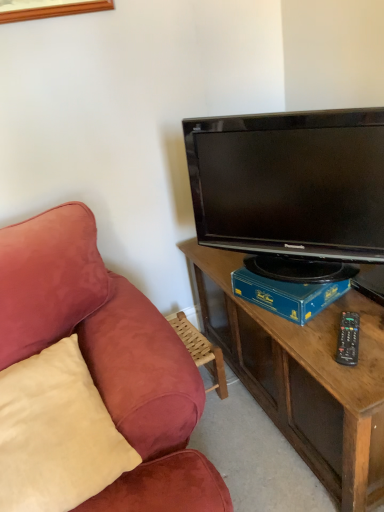
Question: Considering the relative sizes of black plastic remote control at right and black glossy tv at upper right in the image provided, is black plastic remote control at right wider than black glossy tv at upper right?

Choices:
 (A) no
 (B) yes

Answer: (B)

Question: Is the surface of black plastic remote control at right in direct contact with black glossy tv at upper right?

Choices:
 (A) yes
 (B) no

Answer: (B)

Question: Is black plastic remote control at right thinner than black glossy tv at upper right?

Choices:
 (A) yes
 (B) no

Answer: (B)

Question: Considering the relative positions of black plastic remote control at right and black glossy tv at upper right in the image provided, is black plastic remote control at right to the right of black glossy tv at upper right from the viewer's perspective?

Choices:
 (A) yes
 (B) no

Answer: (A)

Question: Is black plastic remote control at right further to the viewer compared to black glossy tv at upper right?

Choices:
 (A) yes
 (B) no

Answer: (A)

Question: Would you say black glossy tv at upper right is to the left or to the right of blue cardboard box at center in the picture?

Choices:
 (A) right
 (B) left

Answer: (B)

Question: From a real-world perspective, is black glossy tv at upper right positioned above or below blue cardboard box at center?

Choices:
 (A) below
 (B) above

Answer: (B)

Question: Is black glossy tv at upper right spatially inside blue cardboard box at center, or outside of it?

Choices:
 (A) inside
 (B) outside

Answer: (B)

Question: Considering the positions of black glossy tv at upper right and blue cardboard box at center in the image, is black glossy tv at upper right wider or thinner than blue cardboard box at center?

Choices:
 (A) wide
 (B) thin

Answer: (B)

Question: In the image, is black glossy tv at upper right positioned in front of or behind beige suede pillow at left?

Choices:
 (A) front
 (B) behind

Answer: (B)

Question: Looking at their shapes, would you say black glossy tv at upper right is wider or thinner than beige suede pillow at left?

Choices:
 (A) thin
 (B) wide

Answer: (A)

Question: Considering the positions of black glossy tv at upper right and beige suede pillow at left in the image, is black glossy tv at upper right bigger or smaller than beige suede pillow at left?

Choices:
 (A) big
 (B) small

Answer: (A)

Question: Is point (279, 176) closer or farther from the camera than point (99, 431)?

Choices:
 (A) farther
 (B) closer

Answer: (A)

Question: In terms of width, does blue cardboard box at center look wider or thinner when compared to beige suede pillow at left?

Choices:
 (A) wide
 (B) thin

Answer: (B)

Question: From the image's perspective, relative to beige suede pillow at left, is blue cardboard box at center above or below?

Choices:
 (A) above
 (B) below

Answer: (A)